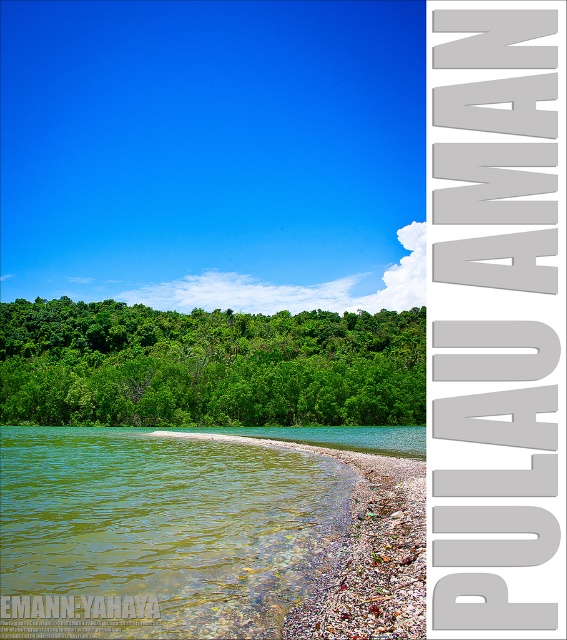
Question: Which point appears farthest from the camera in this image?

Choices:
 (A) (215, 625)
 (B) (297, 401)

Answer: (B)

Question: Does green translucent water at lower left appear on the right side of green leafy trees at center?

Choices:
 (A) yes
 (B) no

Answer: (A)

Question: Which point is farther to the camera?

Choices:
 (A) green translucent water at lower left
 (B) green leafy trees at center

Answer: (B)

Question: Among these objects, which one is nearest to the camera?

Choices:
 (A) green translucent water at lower left
 (B) green leafy trees at center

Answer: (A)

Question: Does green translucent water at lower left appear under green leafy trees at center?

Choices:
 (A) no
 (B) yes

Answer: (B)

Question: Does green translucent water at lower left have a greater width compared to green leafy trees at center?

Choices:
 (A) no
 (B) yes

Answer: (A)